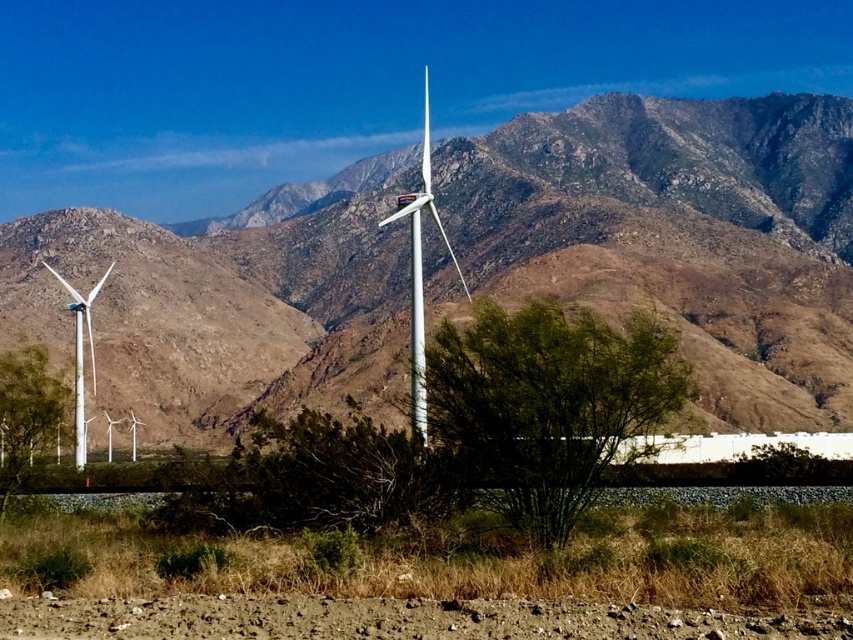
You are standing in the desert landscape and notice the brown rocky mountain range at center and the white matte wind turbine at left. Which object is positioned higher in the scene?

The brown rocky mountain range at center is located above the white matte wind turbine at left, so it is positioned higher in the scene.

You are standing at the point marked as point (x=421, y=272) in the image. What object are you standing on?

You are standing on the white matte wind turbine at center.

You are standing at the point marked by the coordinates point (679, 236) in the image. What is the immediate terrain feature you are standing on?

The point (679, 236) marks brown rocky mountain range at center, so you are standing on a brown rocky mountain range.